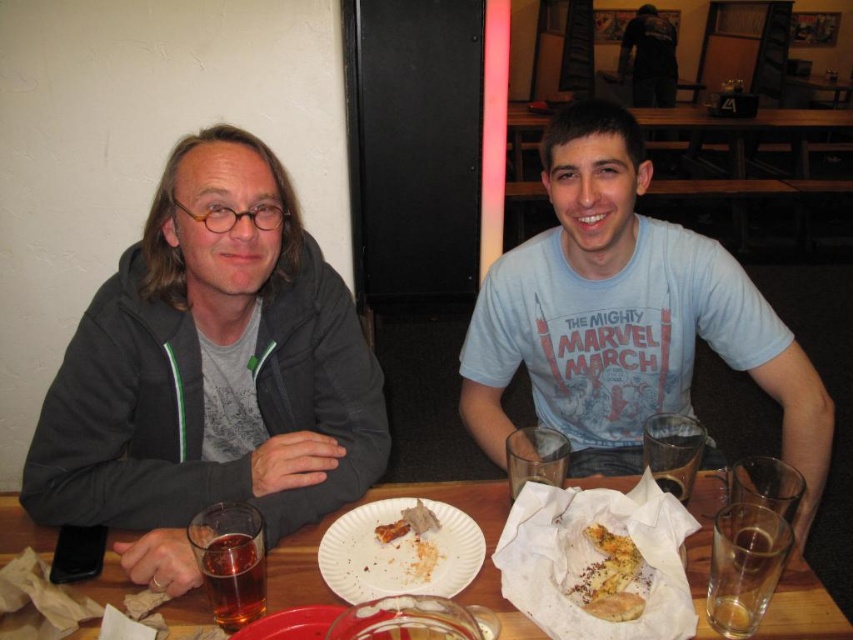
Does wooden table at center appear on the right side of white paper plate at center?

In fact, wooden table at center is to the left of white paper plate at center.

What do you see at coordinates (485, 538) in the screenshot? This screenshot has width=853, height=640. I see `wooden table at center` at bounding box center [485, 538].

Image resolution: width=853 pixels, height=640 pixels. I want to click on wooden table at center, so click(485, 538).

Does point (450, 483) come farther from viewer compared to point (398, 531)?

Yes, it is.

Which is behind, point (717, 483) or point (405, 576)?

The point (717, 483) is behind.

Identify the location of wooden table at center. (485, 538).

Can you confirm if translucent glass at table right is thinner than brown crumbly bread at center?

Yes, translucent glass at table right is thinner than brown crumbly bread at center.

Who is higher up, translucent glass at table right or brown crumbly bread at center?

Positioned higher is translucent glass at table right.

Who is more forward, (769, 573) or (418, 504)?

Positioned in front is point (769, 573).

Image resolution: width=853 pixels, height=640 pixels. What are the coordinates of `translucent glass at table right` in the screenshot? It's located at (744, 566).